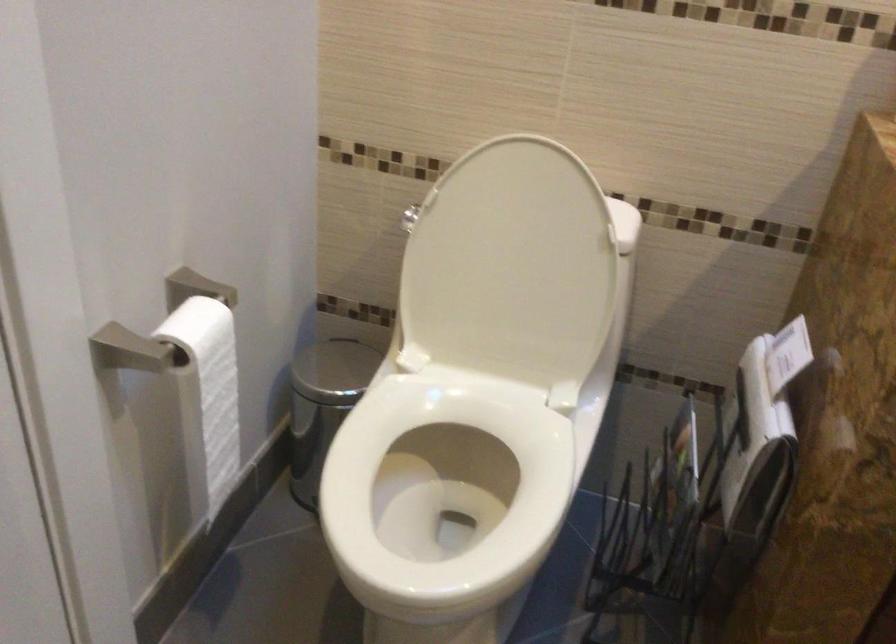
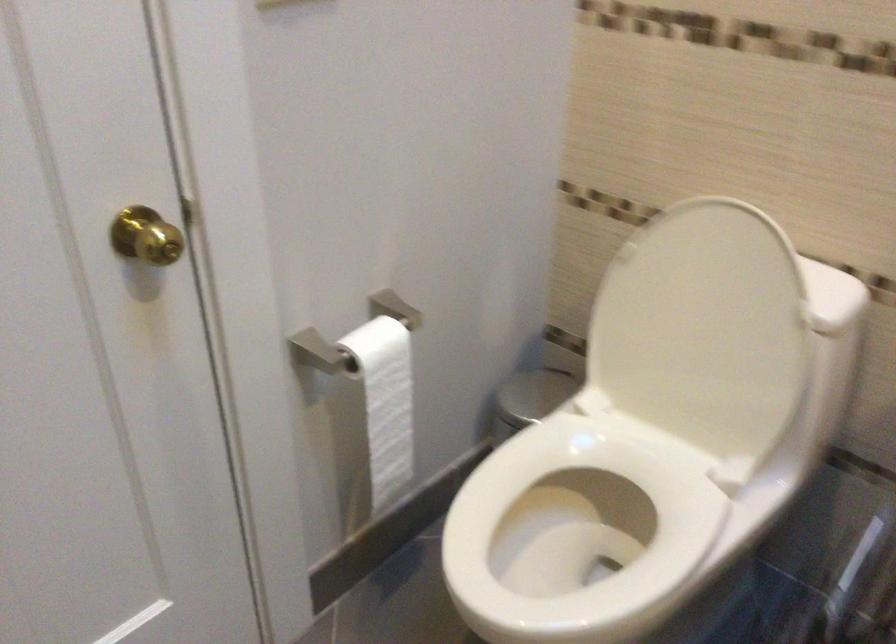
Where in the second image is the point corresponding to (214,395) from the first image?

(385, 402)